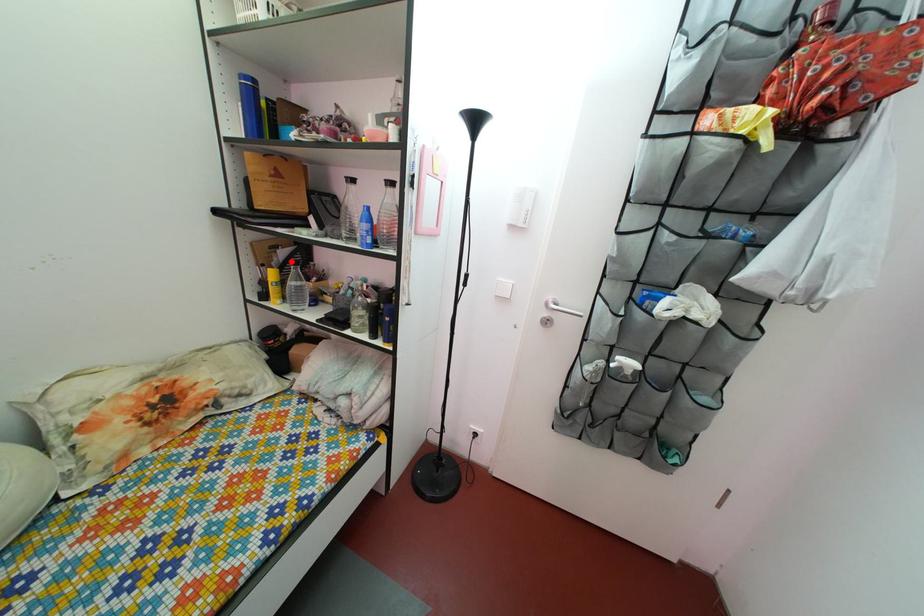
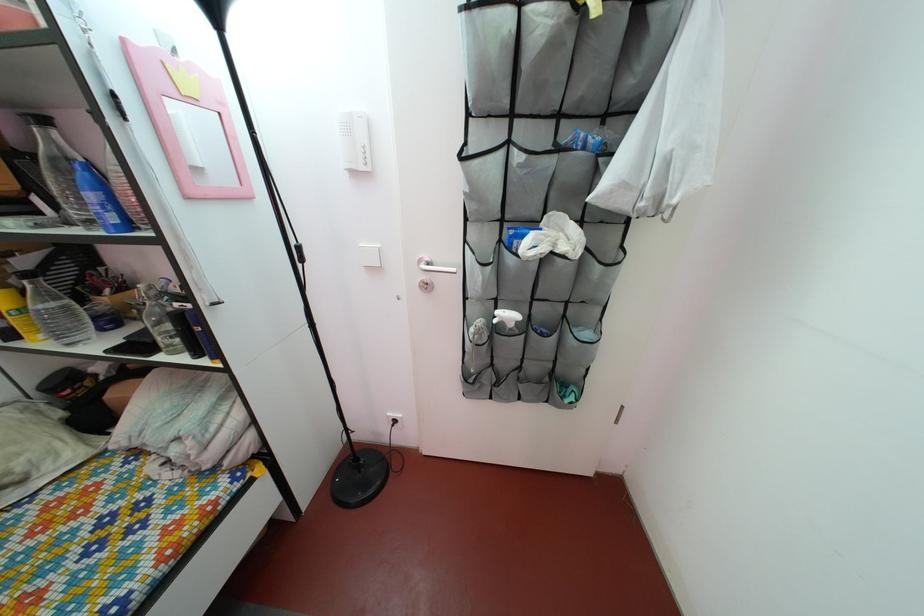
Where in the second image is the point corresponding to the highlighted location from the first image?

(32, 270)